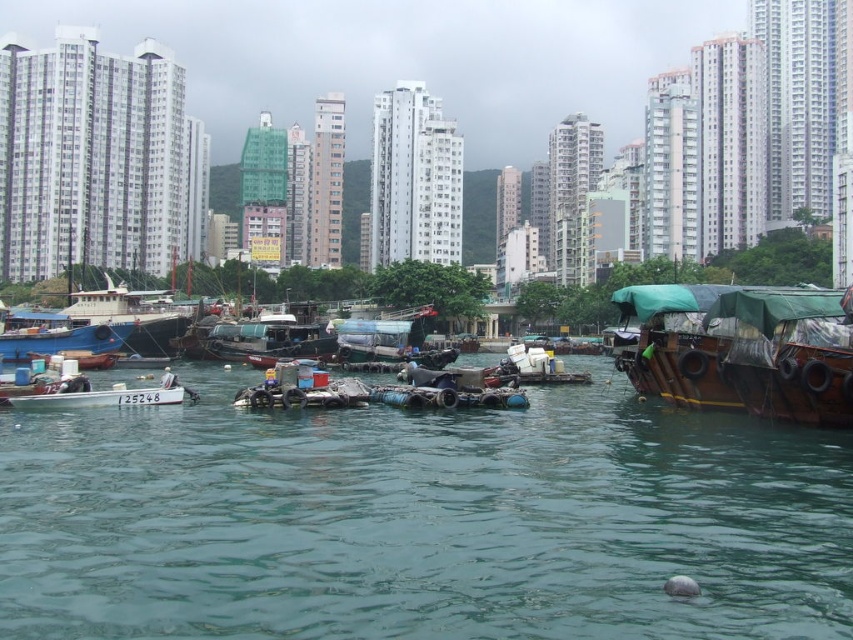
Question: Considering the relative positions of blue matte boat at left and white matte boat at left in the image provided, where is blue matte boat at left located with respect to white matte boat at left?

Choices:
 (A) left
 (B) right

Answer: (A)

Question: Which point is farther from the camera taking this photo?

Choices:
 (A) (749, 314)
 (B) (74, 541)
 (C) (91, 403)
 (D) (302, 317)

Answer: (D)

Question: Which object is farther from the camera taking this photo?

Choices:
 (A) green canvas boat at right
 (B) clear water at center
 (C) blue matte boat at left

Answer: (C)

Question: Does green canvas boat at right appear over wooden boat at center?

Choices:
 (A) no
 (B) yes

Answer: (A)

Question: In this image, where is green canvas boat at right located relative to wooden boat at center?

Choices:
 (A) right
 (B) left

Answer: (A)

Question: Which object appears closest to the camera in this image?

Choices:
 (A) clear water at center
 (B) wooden boat at center
 (C) blue matte boat at left

Answer: (A)